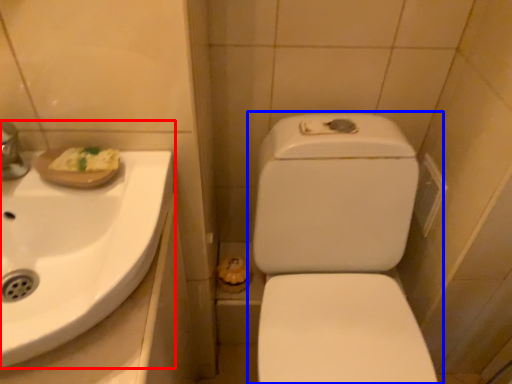
Question: Which object appears farthest to the camera in this image, sink (highlighted by a red box) or toilet (highlighted by a blue box)?

Choices:
 (A) sink
 (B) toilet

Answer: (B)